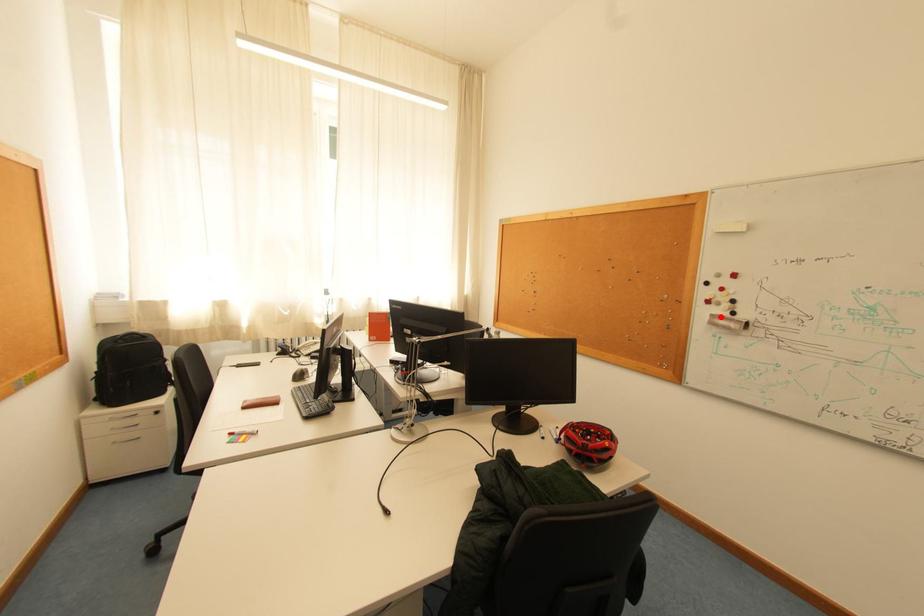
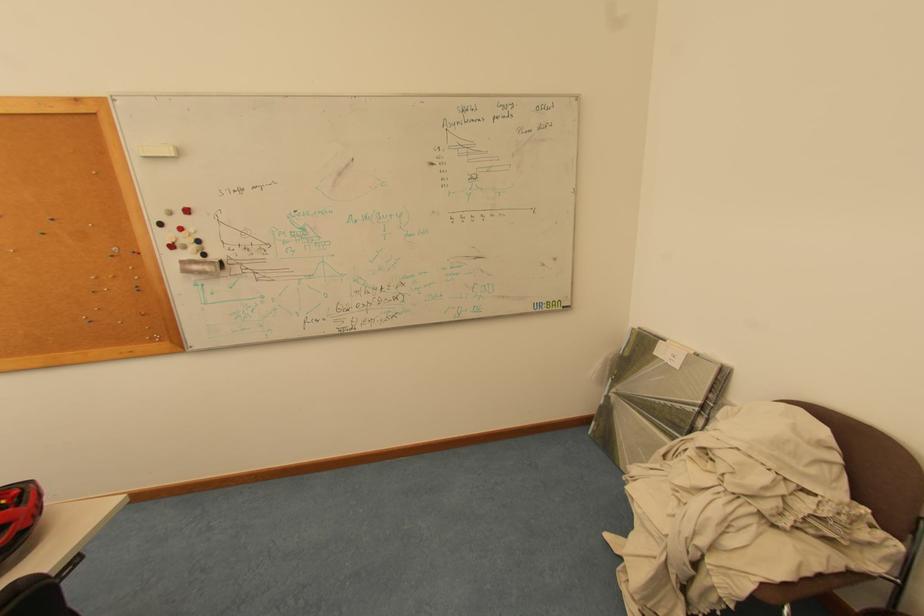
In the second image, find the point that corresponds to the highlighted location in the first image.

(190, 264)